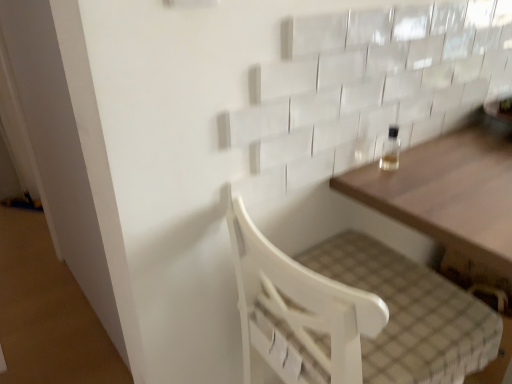
Locate an element on the screen. The image size is (512, 384). white wood chair at lower center is located at coordinates (349, 308).

Measure the distance between wooden table at upper right and camera.

wooden table at upper right and camera are 29.49 inches apart from each other.

Locate an element on the screen. The image size is (512, 384). white wood chair at lower center is located at coordinates (349, 308).

Consider the image. Could white wood chair at lower center be considered to be inside wooden table at upper right?

No, white wood chair at lower center is not a part of wooden table at upper right.

Which of these two, wooden table at upper right or white wood chair at lower center, stands shorter?

With less height is wooden table at upper right.

Is wooden table at upper right facing towards white wood chair at lower center?

No, wooden table at upper right is not facing towards white wood chair at lower center.

Does point (462, 153) appear closer or farther from the camera than point (415, 326)?

Point (462, 153).

Considering their positions, is clear glass bottle at upper right located in front of or behind wooden table at upper right?

clear glass bottle at upper right is behind wooden table at upper right.

From a real-world perspective, relative to wooden table at upper right, is clear glass bottle at upper right vertically above or below?

clear glass bottle at upper right is situated higher than wooden table at upper right in the real world.

Could you tell me if clear glass bottle at upper right is facing wooden table at upper right?

No, clear glass bottle at upper right is not facing towards wooden table at upper right.

Is wooden table at upper right a part of clear glass bottle at upper right?

Definitely not — wooden table at upper right is not inside clear glass bottle at upper right.

Consider the image. Could you tell me if white wood chair at lower center is facing clear glass bottle at upper right?

Yes, white wood chair at lower center faces towards clear glass bottle at upper right.

In the scene shown: From the image's perspective, is white wood chair at lower center above or below clear glass bottle at upper right?

white wood chair at lower center is situated lower than clear glass bottle at upper right in the image.

Considering the sizes of objects white wood chair at lower center and clear glass bottle at upper right in the image provided, who is smaller, white wood chair at lower center or clear glass bottle at upper right?

Smaller between the two is clear glass bottle at upper right.

Is clear glass bottle at upper right positioned with its back to white wood chair at lower center?

That's not correct — clear glass bottle at upper right is not looking away from white wood chair at lower center.

Which of these two, clear glass bottle at upper right or white wood chair at lower center, is bigger?

Bigger between the two is white wood chair at lower center.

Which is more to the right, clear glass bottle at upper right or white wood chair at lower center?

From the viewer's perspective, clear glass bottle at upper right appears more on the right side.

Where is `bottle lying on the right of white wood chair at lower center`? The height and width of the screenshot is (384, 512). bottle lying on the right of white wood chair at lower center is located at coordinates (391, 150).

In the scene shown: Is wooden table at upper right taller than clear glass bottle at upper right?

Yes, wooden table at upper right is taller than clear glass bottle at upper right.

Considering the positions of objects wooden table at upper right and clear glass bottle at upper right in the image provided, who is more to the right, wooden table at upper right or clear glass bottle at upper right?

wooden table at upper right is more to the right.

How far apart are wooden table at upper right and clear glass bottle at upper right?

6.33 inches.

Can you tell me how much wooden table at upper right and clear glass bottle at upper right differ in facing direction?

The angle between the facing direction of wooden table at upper right and the facing direction of clear glass bottle at upper right is 4.1 degrees.

From the image's perspective, is white wood chair at lower center on wooden table at upper right?

No, from the image's perspective, white wood chair at lower center is not above wooden table at upper right.

Is point (335, 284) positioned after point (389, 196)?

That is False.

Considering the relative sizes of white wood chair at lower center and wooden table at upper right in the image provided, is white wood chair at lower center smaller than wooden table at upper right?

Yes, white wood chair at lower center is smaller than wooden table at upper right.

From a real-world perspective, is white wood chair at lower center positioned over wooden table at upper right based on gravity?

Indeed, from a real-world perspective, white wood chair at lower center stands above wooden table at upper right.

At what (x,y) coordinates should I click in order to perform the action: click on table behind the white wood chair at lower center. Please return your answer as a coordinate pair (x, y). The width and height of the screenshot is (512, 384). Looking at the image, I should click on click(449, 198).

Where is `bottle lying above the wooden table at upper right (from the image's perspective)`? This screenshot has width=512, height=384. bottle lying above the wooden table at upper right (from the image's perspective) is located at coordinates (391, 150).

Looking at the image, which one is located closer to white wood chair at lower center, wooden table at upper right or clear glass bottle at upper right?

Based on the image, wooden table at upper right appears to be nearer to white wood chair at lower center.

Estimate the real-world distances between objects in this image. Which object is further from clear glass bottle at upper right, wooden table at upper right or white wood chair at lower center?

white wood chair at lower center is positioned further to the anchor clear glass bottle at upper right.

Based on their spatial positions, is clear glass bottle at upper right or white wood chair at lower center closer to wooden table at upper right?

The object closer to wooden table at upper right is clear glass bottle at upper right.

Considering their positions, is clear glass bottle at upper right positioned further to white wood chair at lower center than wooden table at upper right?

Based on the image, clear glass bottle at upper right appears to be further to white wood chair at lower center.

Considering their positions, is white wood chair at lower center positioned further to clear glass bottle at upper right than wooden table at upper right?

The object further to clear glass bottle at upper right is white wood chair at lower center.

Consider the image. From the image, which object appears to be farther from wooden table at upper right, white wood chair at lower center or clear glass bottle at upper right?

white wood chair at lower center is further to wooden table at upper right.

Locate an element on the screen. This screenshot has width=512, height=384. bottle situated between white wood chair at lower center and wooden table at upper right from left to right is located at coordinates (391, 150).